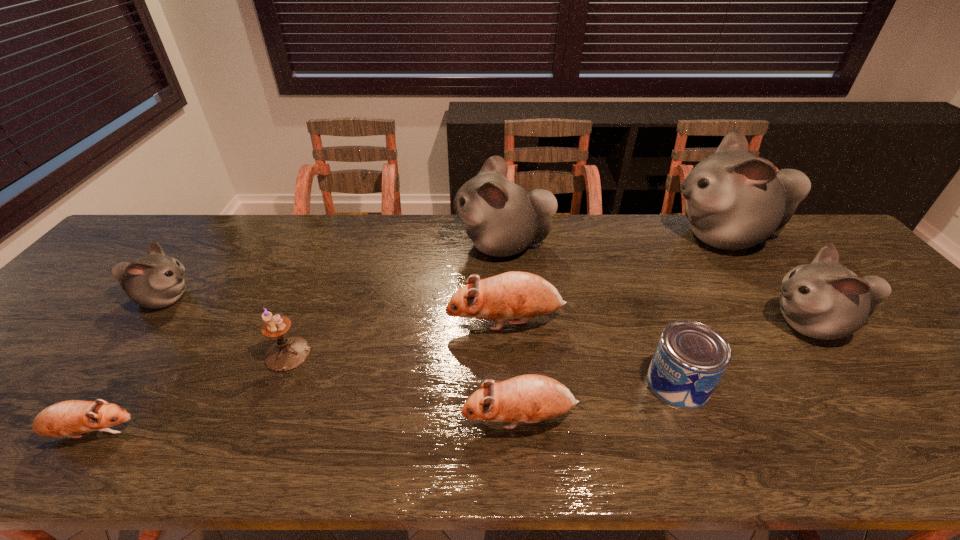
You are a GUI agent. You are given a task and a screenshot of the screen. Output one action in this format:
    pyautogui.click(x=<x>, y=<y>)
    Task: Click on the vacant region at the right edge of the desktop
    Image resolution: width=960 pixels, height=540 pixels.
    Given the screenshot: What is the action you would take?
    pyautogui.click(x=930, y=386)

Identify the location of vacant space at the far left corner. This screenshot has width=960, height=540. (138, 250).

At what (x,y) coordinates should I click in order to perform the action: click on free space at the far right corner of the desktop. Please return your answer as a coordinate pair (x, y). The width and height of the screenshot is (960, 540). Looking at the image, I should click on (845, 252).

Identify the location of vacant space that is in between the third biggest white hamster and the sixth shortest hamster. The width and height of the screenshot is (960, 540). (658, 285).

Locate an element on the screen. free area in between the biggest brown hamster and the smallest brown hamster is located at coordinates (299, 377).

Locate an element on the screen. vacant area that lies between the candle holder and the third tallest object is located at coordinates (549, 339).

Where is `vacant area that lies between the biggest brown hamster and the seventh object from left to right`? This screenshot has height=540, width=960. vacant area that lies between the biggest brown hamster and the seventh object from left to right is located at coordinates (592, 353).

Where is `free space between the biggest white hamster and the leftmost brown hamster`? Image resolution: width=960 pixels, height=540 pixels. free space between the biggest white hamster and the leftmost brown hamster is located at coordinates (407, 335).

The image size is (960, 540). Find the location of `vacant area that lies between the smallest white hamster and the blue can`. vacant area that lies between the smallest white hamster and the blue can is located at coordinates (421, 341).

This screenshot has width=960, height=540. In order to click on free spot between the second tallest hamster and the fifth shortest hamster in this screenshot , I will do `click(658, 285)`.